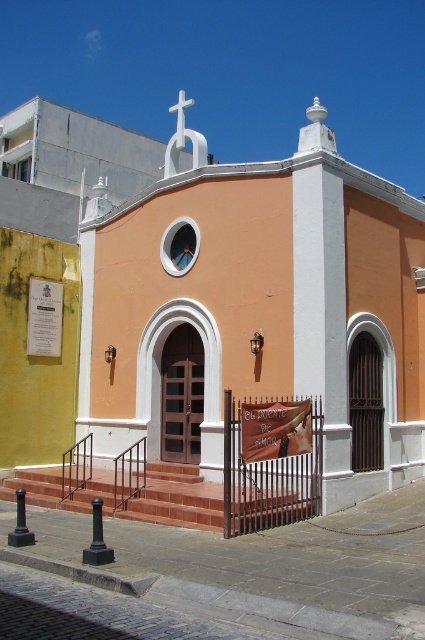
You are standing at the point marked by the coordinates point [215,326] in the image of the church. What is the closest object to you?

The closest object to you at point [215,326] is the matte orange church at center, as the point marks its location.

You are standing at the entrance of the church and want to walk to the point marked as point (308,237). However, there is an obstacle at point (201,522) blocking your path. Can you reach your destination without going around the obstacle?

Since point (308,237) is behind point (201,522), you cannot reach point (308,237) without going around the obstacle at point (201,522).

You are standing at the entrance of the matte orange church at center. If you face the main entrance, which direction would the prominent cross at the top center of the building be relative to you?

The prominent cross at the top center of the building is directly above the entrance, so it would be directly in front of you when facing the main entrance.